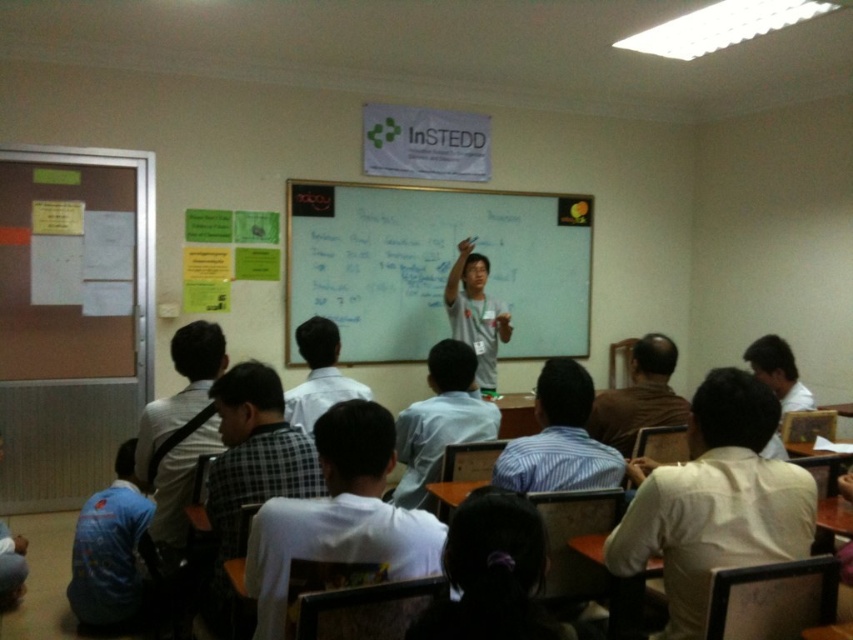
Question: Among these objects, which one is nearest to the camera?

Choices:
 (A) whiteboard at center
 (B) white shirt at center
 (C) gray cotton shirt at center
 (D) striped shirt at center

Answer: (B)

Question: Among these points, which one is nearest to the camera?

Choices:
 (A) (370, 218)
 (B) (456, 326)

Answer: (B)

Question: Can you confirm if whiteboard at center is thinner than striped shirt at center?

Choices:
 (A) no
 (B) yes

Answer: (A)

Question: Which of the following is the closest to the observer?

Choices:
 (A) (577, 481)
 (B) (795, 528)
 (C) (482, 198)
 (D) (469, 276)

Answer: (B)

Question: In this image, where is white shirt at center located relative to gray cotton shirt at center?

Choices:
 (A) above
 (B) below

Answer: (B)

Question: Is whiteboard at center bigger than white shirt at center?

Choices:
 (A) no
 (B) yes

Answer: (B)